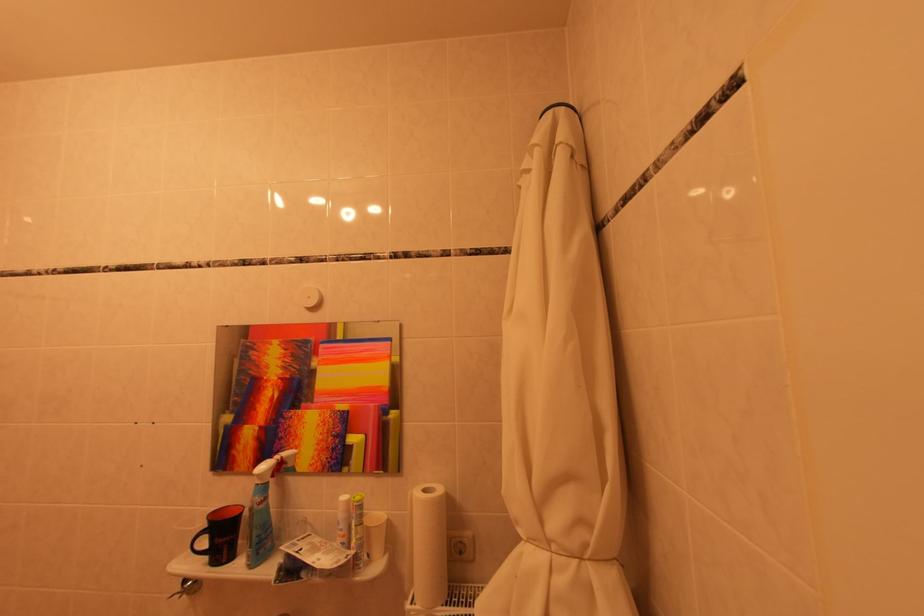
The height and width of the screenshot is (616, 924). Describe the element at coordinates (274, 464) in the screenshot. I see `the blue spray bottle trigger` at that location.